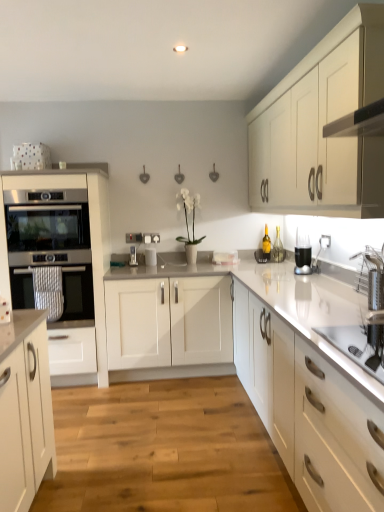
Question: Is metallic silver toaster at center, the 2th appliance positioned from the right, a part of satin white oven at left, placed as the first cabinetry when sorted from left to right?

Choices:
 (A) yes
 (B) no

Answer: (B)

Question: Does satin white oven at left, the second cabinetry positioned from the right, come in front of metallic silver toaster at center, the 2th appliance positioned from the right?

Choices:
 (A) no
 (B) yes

Answer: (B)

Question: Can you confirm if satin white oven at left, the second cabinetry positioned from the right, is bigger than metallic silver toaster at center, placed as the 1th appliance when sorted from left to right?

Choices:
 (A) yes
 (B) no

Answer: (A)

Question: Does satin white oven at left, the second cabinetry positioned from the right, have a greater width compared to metallic silver toaster at center, placed as the 1th appliance when sorted from left to right?

Choices:
 (A) yes
 (B) no

Answer: (A)

Question: Is satin white oven at left, the second cabinetry positioned from the right, not close to metallic silver toaster at center, the 2th appliance positioned from the right?

Choices:
 (A) no
 (B) yes

Answer: (A)

Question: Does satin white oven at left, placed as the first cabinetry when sorted from left to right, turn towards metallic silver toaster at center, placed as the 1th appliance when sorted from left to right?

Choices:
 (A) yes
 (B) no

Answer: (B)

Question: Does satin black oven at left, the 2th oven from the bottom, have a lesser width compared to stainless steel oven at left, the 2th oven positioned from the top?

Choices:
 (A) no
 (B) yes

Answer: (A)

Question: Is satin black oven at left, the 2th oven from the bottom, taller than stainless steel oven at left, the first oven positioned from the bottom?

Choices:
 (A) yes
 (B) no

Answer: (B)

Question: From a real-world perspective, is satin black oven at left, the 2th oven from the bottom, below stainless steel oven at left, the first oven positioned from the bottom?

Choices:
 (A) yes
 (B) no

Answer: (B)

Question: Does satin black oven at left, marked as the 1th oven in a top-to-bottom arrangement, turn towards stainless steel oven at left, the 2th oven positioned from the top?

Choices:
 (A) yes
 (B) no

Answer: (B)

Question: Does satin black oven at left, the 2th oven from the bottom, have a larger size compared to stainless steel oven at left, the 2th oven positioned from the top?

Choices:
 (A) no
 (B) yes

Answer: (A)

Question: Is satin black oven at left, the 2th oven from the bottom, not inside stainless steel oven at left, the first oven positioned from the bottom?

Choices:
 (A) yes
 (B) no

Answer: (A)

Question: Can you confirm if white matte cabinet at upper right, the 2th cabinetry positioned from the left, is positioned to the right of satin white oven at left, the second cabinetry positioned from the right?

Choices:
 (A) yes
 (B) no

Answer: (A)